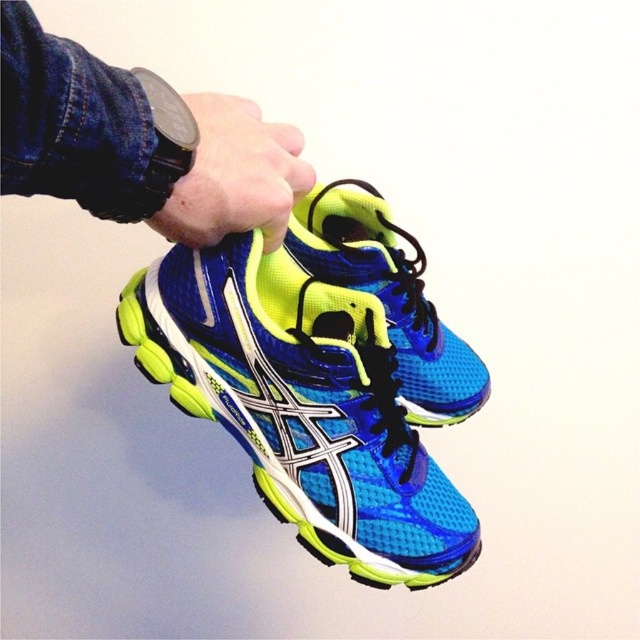
You are a shoe designer examining the image of the blue mesh running shoe at center and the black rubber wristwatch at upper center. Which object would require more material to produce, considering their size difference?

The blue mesh running shoe at center requires more material to produce than the black rubber wristwatch at upper center because it is larger in size.

You are a photographer setting up a shoot for a product catalog. You have a blue mesh running shoe at center and a black watch at upper center. Which object should you focus on first if you want to capture the wider item in your frame?

The blue mesh running shoe at center should be focused on first because its width is larger than the black watch at upper center.